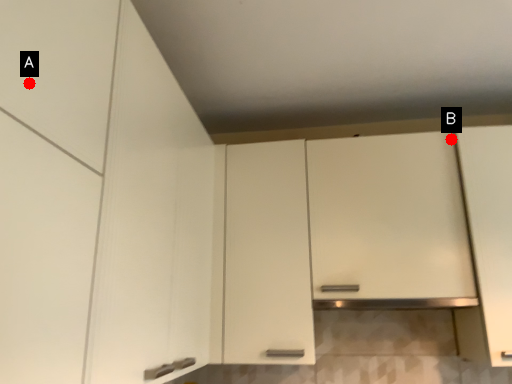
Question: Two points are circled on the image, labeled by A and B beside each circle. Which point is closer to the camera?

Choices:
 (A) A is closer
 (B) B is closer

Answer: (A)